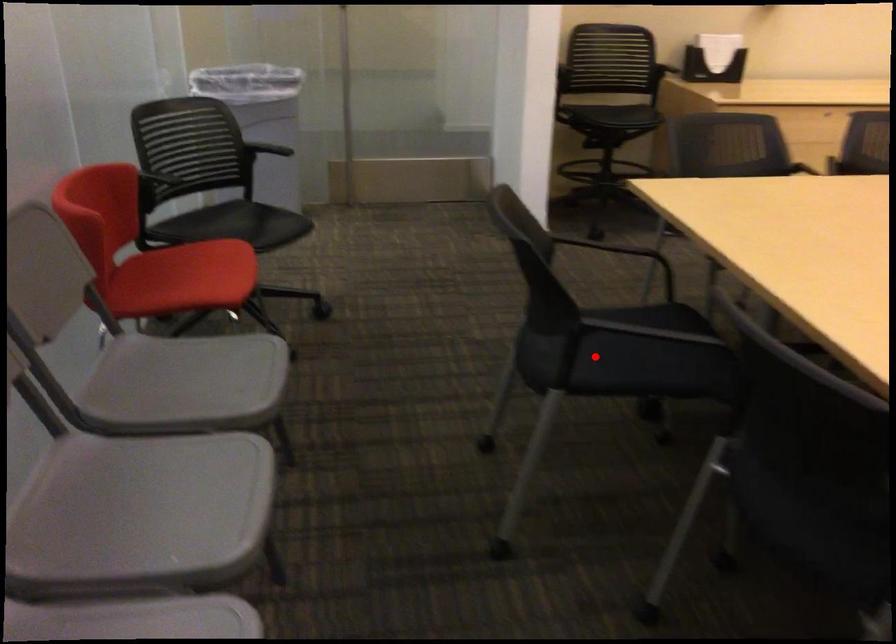
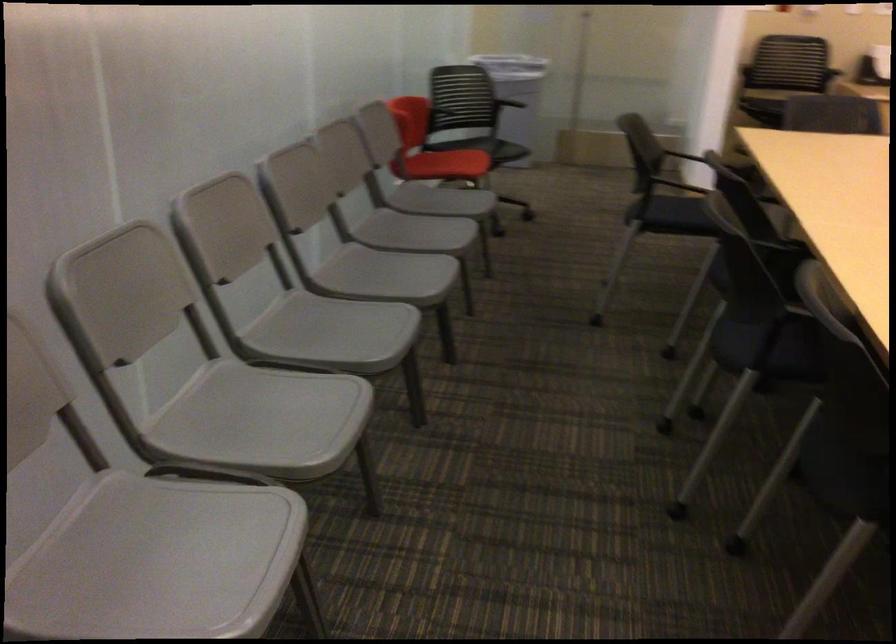
Where in the second image is the point corresponding to the highlighted location from the first image?

(676, 211)